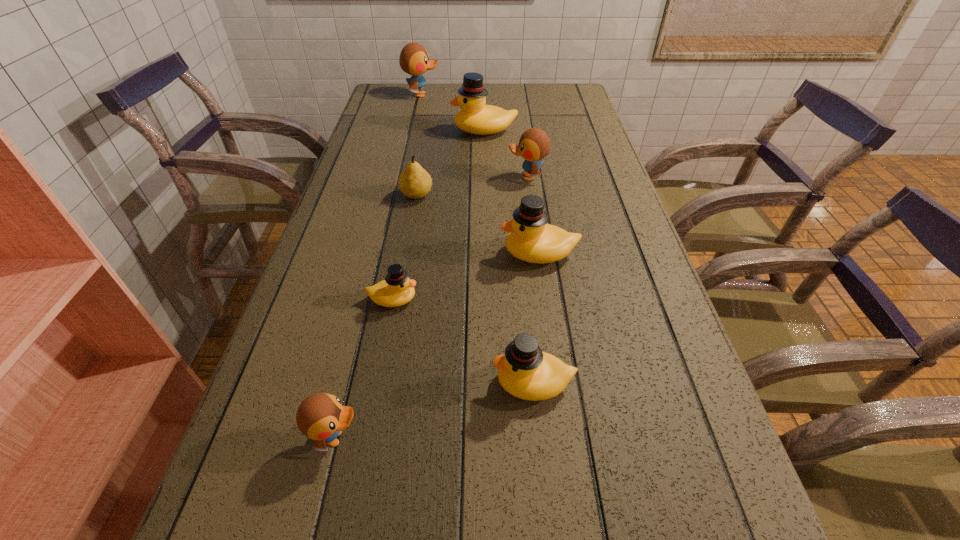
The width and height of the screenshot is (960, 540). I want to click on vacant region between the farthest duck and the fourth nearest duck, so click(481, 174).

Identify the location of vacant region between the fourth farthest object and the second smallest blue duck. (472, 186).

Identify the location of vacant space that is in between the farthest yellow duck and the farthest duck. The width and height of the screenshot is (960, 540). (453, 113).

Where is `free space between the fifth nearest object and the sixth nearest duck`? The image size is (960, 540). free space between the fifth nearest object and the sixth nearest duck is located at coordinates pyautogui.click(x=450, y=163).

At what (x,y) coordinates should I click in order to perform the action: click on vacant space that is in between the biggest yellow duck and the fourth farthest object. Please return your answer as a coordinate pair (x, y). The height and width of the screenshot is (540, 960). Looking at the image, I should click on (450, 163).

You are a GUI agent. You are given a task and a screenshot of the screen. Output one action in this format:
    pyautogui.click(x=<x>, y=<y>)
    Task: Click on the free area in between the fifth nearest duck and the pear
    The width and height of the screenshot is (960, 540).
    Given the screenshot: What is the action you would take?
    pyautogui.click(x=472, y=186)

The width and height of the screenshot is (960, 540). I want to click on free spot between the fourth farthest duck and the third biggest yellow duck, so click(537, 318).

This screenshot has width=960, height=540. Find the location of `empty location between the second biggest yellow duck and the farthest blue duck`. empty location between the second biggest yellow duck and the farthest blue duck is located at coordinates (481, 174).

Find the location of a particular element. This screenshot has height=540, width=960. vacant space that's between the second nearest yellow duck and the second nearest blue duck is located at coordinates (460, 238).

Find the location of a particular element. The width and height of the screenshot is (960, 540). the fifth closest object to the farthest blue duck is located at coordinates (397, 289).